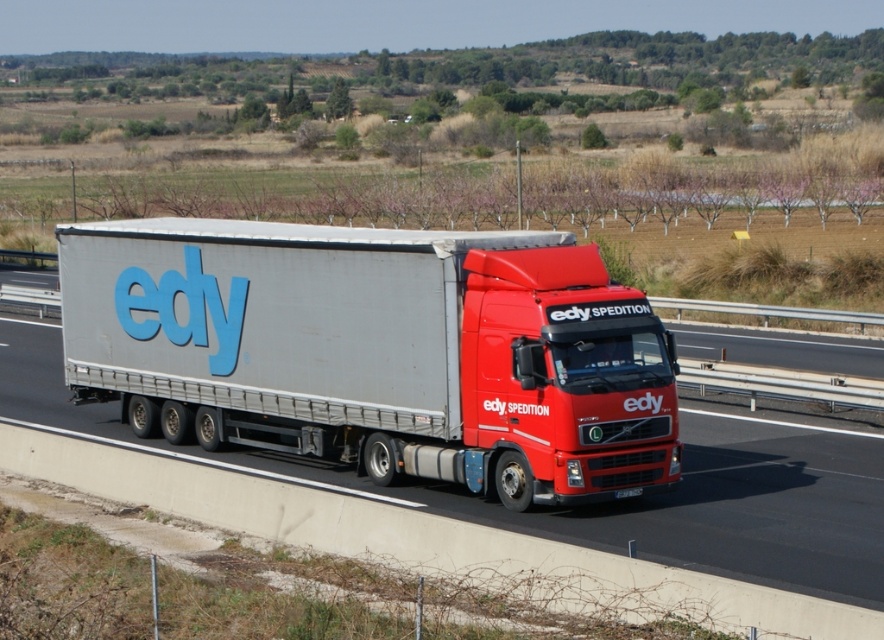
Describe the element at coordinates (377, 349) in the screenshot. I see `silver metallic trailer truck at center` at that location.

Based on the photo, is silver metallic trailer truck at center behind metallic silver trailer at center?

Yes, it is behind metallic silver trailer at center.

In order to click on silver metallic trailer truck at center in this screenshot , I will do `click(377, 349)`.